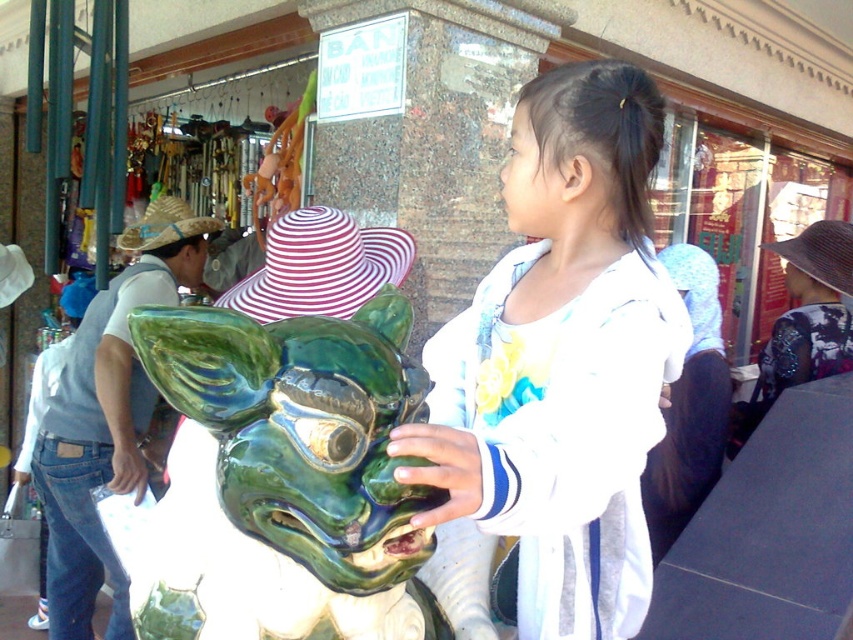
Describe the element at coordinates (556, 371) in the screenshot. I see `white matte shirt at center` at that location.

Which is more to the left, white matte shirt at center or green glazed sculpture at center?

green glazed sculpture at center is more to the left.

This screenshot has height=640, width=853. Describe the element at coordinates (556, 371) in the screenshot. I see `white matte shirt at center` at that location.

Identify the location of white matte shirt at center. (556, 371).